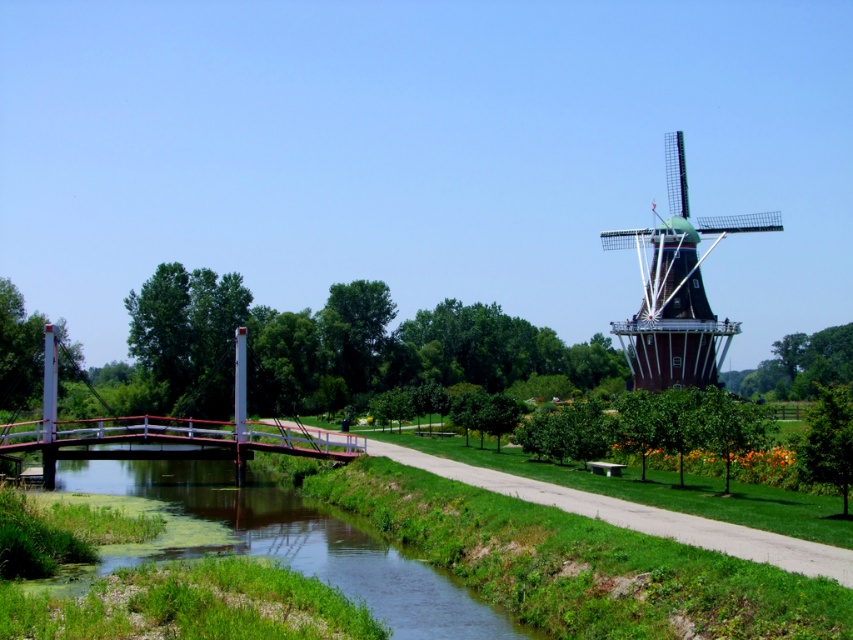
Between green wooden windmill at right and metallic bridge at left, which one is positioned higher?

green wooden windmill at right

Who is lower down, green wooden windmill at right or metallic bridge at left?

metallic bridge at left is lower down.

Between point (682, 275) and point (283, 433), which one is positioned behind?

The point (682, 275) is behind.

Where is `green wooden windmill at right`? The image size is (853, 640). green wooden windmill at right is located at coordinates (677, 288).

Does green grassy river at lower left come behind metallic bridge at center-left?

That is False.

Does point (445, 579) come farther from viewer compared to point (74, 454)?

No.

Locate an element on the screen. green grassy river at lower left is located at coordinates (303, 541).

Can you confirm if green wooden windmill at right is positioned to the left of metallic bridge at center-left?

Incorrect, green wooden windmill at right is not on the left side of metallic bridge at center-left.

Is point (627, 240) positioned in front of point (56, 456)?

No, (627, 240) is further to viewer.

Locate an element on the screen. This screenshot has height=640, width=853. green wooden windmill at right is located at coordinates (677, 288).